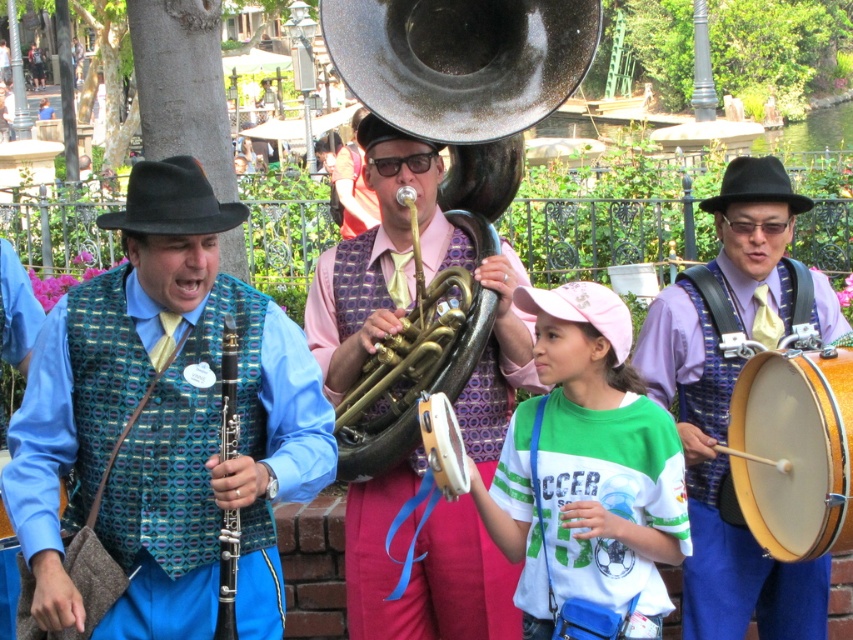
Question: Can you confirm if gold polished tuba at center is positioned above matte black clarinet at left?

Choices:
 (A) no
 (B) yes

Answer: (B)

Question: Which point is farther to the camera?

Choices:
 (A) (751, 403)
 (B) (236, 554)
 (C) (463, 385)
 (D) (682, 356)

Answer: (D)

Question: Based on their relative distances, which object is farther from the white cotton shirt at center?

Choices:
 (A) wooden drum at right
 (B) wooden drum at center
 (C) matte blue vest at center
 (D) matte gold drum at right

Answer: (B)

Question: Can you confirm if matte black clarinet at left is thinner than wooden drum at center?

Choices:
 (A) no
 (B) yes

Answer: (A)

Question: Based on their relative distances, which object is farther from the matte blue vest at center?

Choices:
 (A) white cotton shirt at center
 (B) matte black clarinet at left
 (C) wooden drum at right
 (D) wooden drum at center

Answer: (C)

Question: Can you confirm if matte blue vest at center is smaller than shiny brass trumpet at center?

Choices:
 (A) no
 (B) yes

Answer: (A)